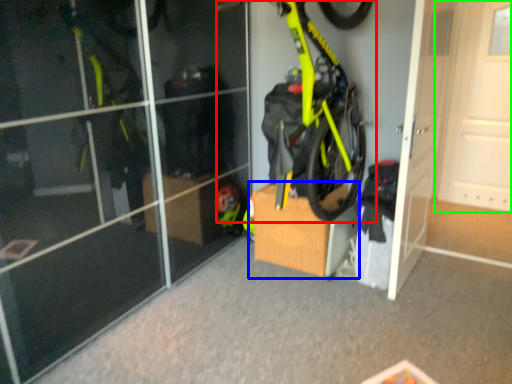
Question: Which object is positioned farthest from bicycle (highlighted by a red box)? Select from cardboard box (highlighted by a blue box) and door (highlighted by a green box).

Choices:
 (A) cardboard box
 (B) door

Answer: (B)